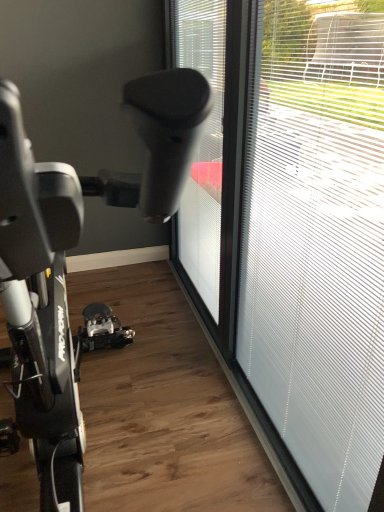
Question: In terms of width, does transparent glass window at right, placed as the second window when sorted from left to right, look wider or thinner when compared to transparent plastic window at center, the first window in the left-to-right sequence?

Choices:
 (A) thin
 (B) wide

Answer: (A)

Question: Does point (359, 326) appear closer or farther from the camera than point (215, 179)?

Choices:
 (A) farther
 (B) closer

Answer: (B)

Question: From a real-world perspective, is transparent glass window at right, placed as the second window when sorted from left to right, positioned above or below transparent plastic window at center, placed as the second window when sorted from right to left?

Choices:
 (A) below
 (B) above

Answer: (A)

Question: Visually, is transparent plastic window at center, the first window in the left-to-right sequence, positioned to the left or to the right of transparent glass window at right, the first window from the right?

Choices:
 (A) left
 (B) right

Answer: (A)

Question: Is transparent plastic window at center, the first window in the left-to-right sequence, in front of or behind transparent glass window at right, placed as the second window when sorted from left to right, in the image?

Choices:
 (A) front
 (B) behind

Answer: (B)

Question: Is transparent plastic window at center, the first window in the left-to-right sequence, bigger or smaller than transparent glass window at right, placed as the second window when sorted from left to right?

Choices:
 (A) big
 (B) small

Answer: (A)

Question: From the image's perspective, relative to transparent glass window at right, placed as the second window when sorted from left to right, is transparent plastic window at center, the first window in the left-to-right sequence, above or below?

Choices:
 (A) above
 (B) below

Answer: (A)